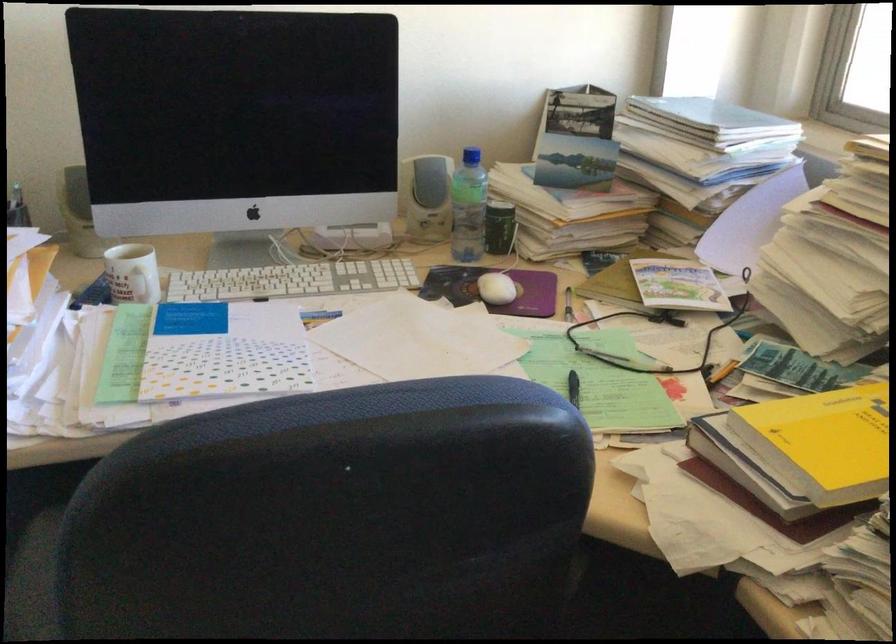
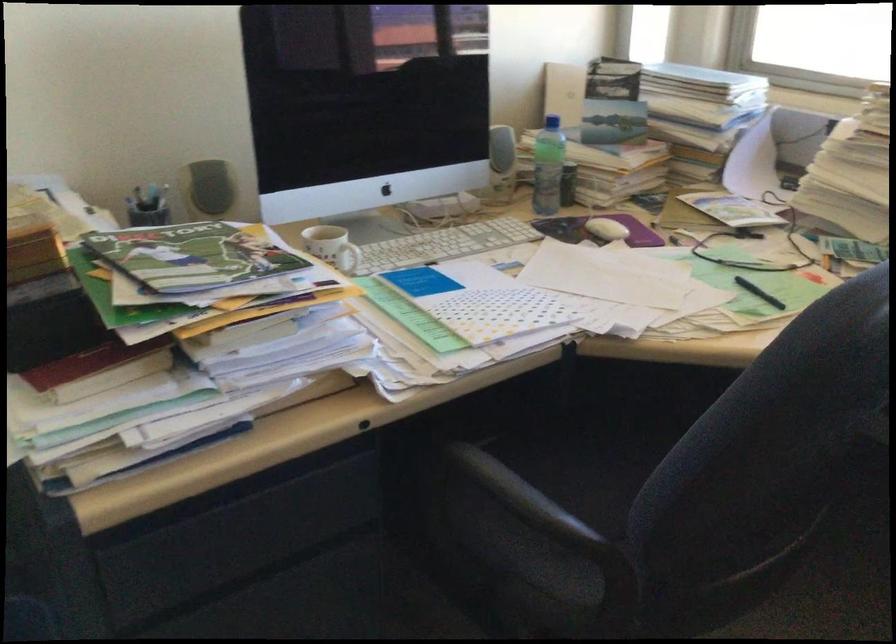
Where in the second image is the point corresponding to point (136, 286) from the first image?

(348, 258)